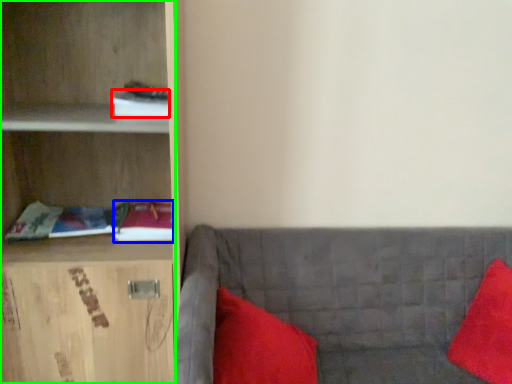
Question: Which object is positioned farthest from book (highlighted by a red box)? Select from book (highlighted by a blue box) and cabinetry (highlighted by a green box).

Choices:
 (A) book
 (B) cabinetry

Answer: (A)